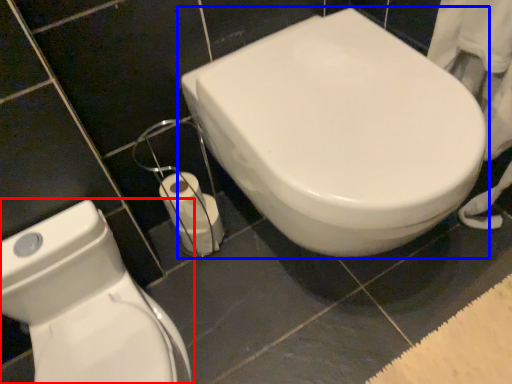
Question: Which object appears closest to the camera in this image, toilet (highlighted by a red box) or toilet (highlighted by a blue box)?

Choices:
 (A) toilet
 (B) toilet

Answer: (A)